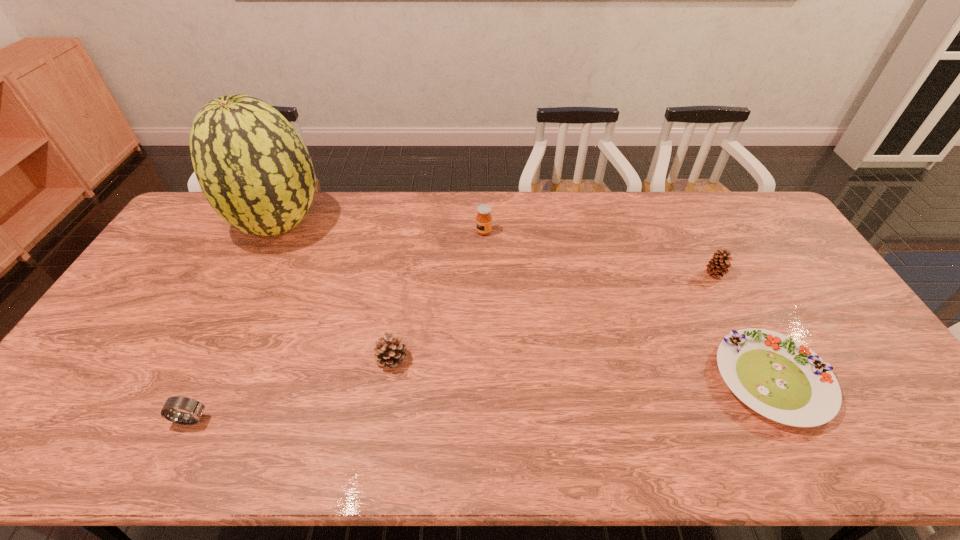
At what (x,y) coordinates should I click in order to perform the action: click on vacant position located 0.330m on the front-facing side of the third object from right to left. Please return your answer as a coordinate pair (x, y). The image size is (960, 540). Looking at the image, I should click on (380, 232).

In order to click on vacant space located 0.210m on the front-facing side of the third object from right to left in this screenshot , I will do `click(416, 232)`.

Locate an element on the screen. The width and height of the screenshot is (960, 540). vacant space located on the front-facing side of the third object from right to left is located at coordinates (450, 232).

Where is `free spot located 0.200m on the left of the fourth object from right to left`? This screenshot has height=540, width=960. free spot located 0.200m on the left of the fourth object from right to left is located at coordinates (300, 358).

Image resolution: width=960 pixels, height=540 pixels. What are the coordinates of `vacant space located 0.180m on the face of the fifth tallest object` in the screenshot? It's located at (284, 419).

Locate an element on the screen. free location located 0.070m on the right of the shortest object is located at coordinates (856, 380).

The width and height of the screenshot is (960, 540). Identify the location of watermelon at the far edge. click(x=252, y=166).

Identify the location of honey located at the far edge. The width and height of the screenshot is (960, 540). (483, 219).

This screenshot has width=960, height=540. Find the location of `watch present at the near edge`. watch present at the near edge is located at coordinates (196, 408).

Locate an element on the screen. salad plate present at the near edge is located at coordinates (778, 377).